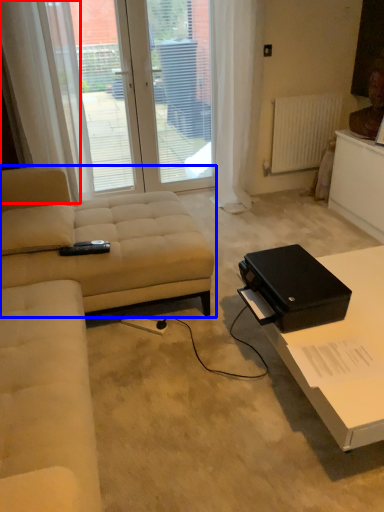
Question: Which point is further to the camera, curtain (highlighted by a red box) or studio couch (highlighted by a blue box)?

Choices:
 (A) curtain
 (B) studio couch

Answer: (A)